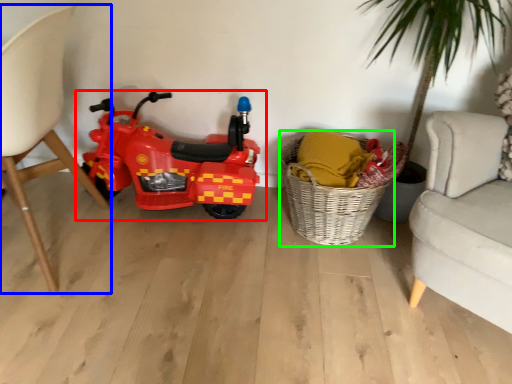
Question: Which object is the farthest from land vehicle (highlighted by a red box)? Choose among these: chair (highlighted by a blue box) or basket (highlighted by a green box).

Choices:
 (A) chair
 (B) basket

Answer: (B)